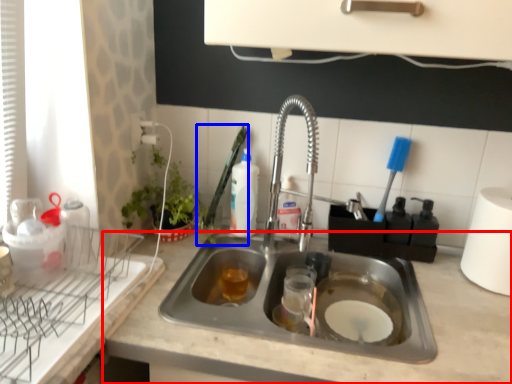
Question: Which object appears farthest to the camera in this image, countertop (highlighted by a red box) or brush (highlighted by a blue box)?

Choices:
 (A) countertop
 (B) brush

Answer: (B)